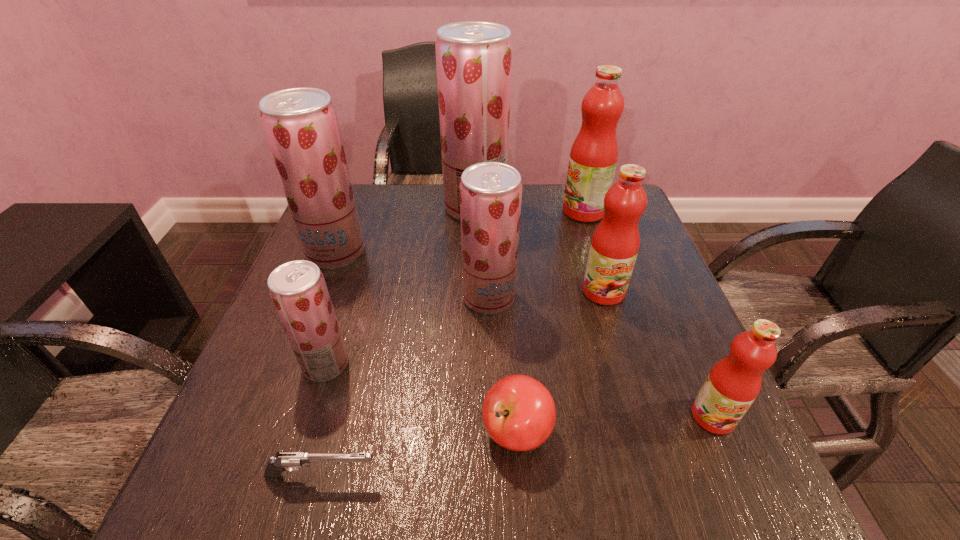
Identify the location of free space between the silver pistol and the second smallest strawberry fruit juice. (405, 387).

Find the location of a particular element. vacant space in between the second biggest pink fruit juice and the second shortest object is located at coordinates (561, 362).

Locate an element on the screen. This screenshot has width=960, height=540. free space that is in between the nearest strawberry fruit juice and the farthest pink fruit juice is located at coordinates (455, 288).

Where is `object that is the eighth closest to the shortest object`? object that is the eighth closest to the shortest object is located at coordinates (593, 158).

Select which object is the third closest to the third farthest fruit juice. Please provide its 2D coordinates. Your answer should be formatted as a tuple, i.e. [(x, y)], where the tuple contains the x and y coordinates of a point satisfying the conditions above.

[(490, 192)]

Find the location of a particular element. fruit juice that is the second closest to the second nearest strawberry fruit juice is located at coordinates (473, 58).

Point out which fruit juice is positioned as the sixth nearest to the farthest strawberry fruit juice. Please provide its 2D coordinates. Your answer should be formatted as a tuple, i.e. [(x, y)], where the tuple contains the x and y coordinates of a point satisfying the conditions above.

[(734, 382)]

This screenshot has height=540, width=960. I want to click on strawberry fruit juice that stands as the second closest to the second shortest object, so click(298, 290).

Point out which strawberry fruit juice is positioned as the fourth nearest to the silver pistol. Please provide its 2D coordinates. Your answer should be formatted as a tuple, i.e. [(x, y)], where the tuple contains the x and y coordinates of a point satisfying the conditions above.

[(473, 58)]

Locate which pink fruit juice ranks second in proximity to the second nearest pink fruit juice. Please provide its 2D coordinates. Your answer should be formatted as a tuple, i.e. [(x, y)], where the tuple contains the x and y coordinates of a point satisfying the conditions above.

[(734, 382)]